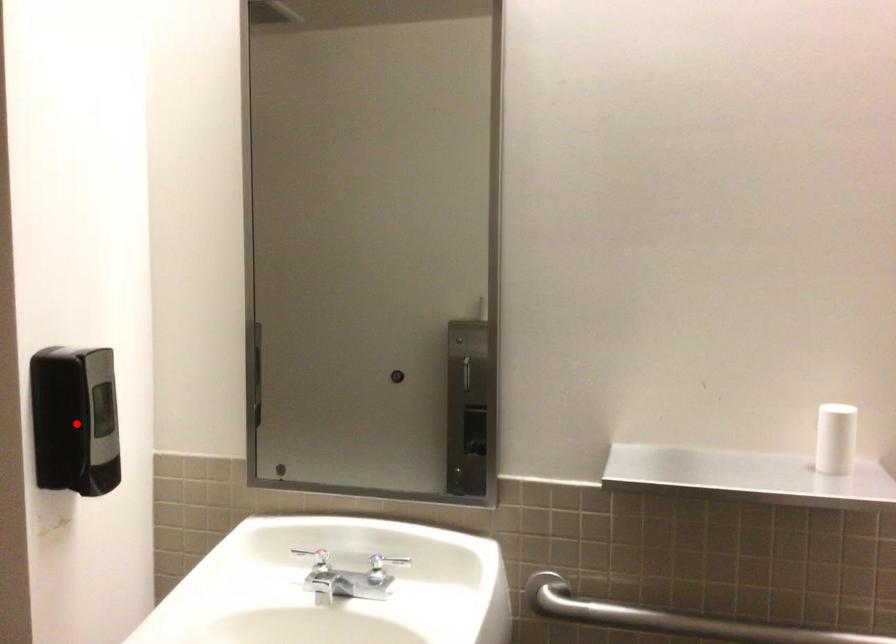
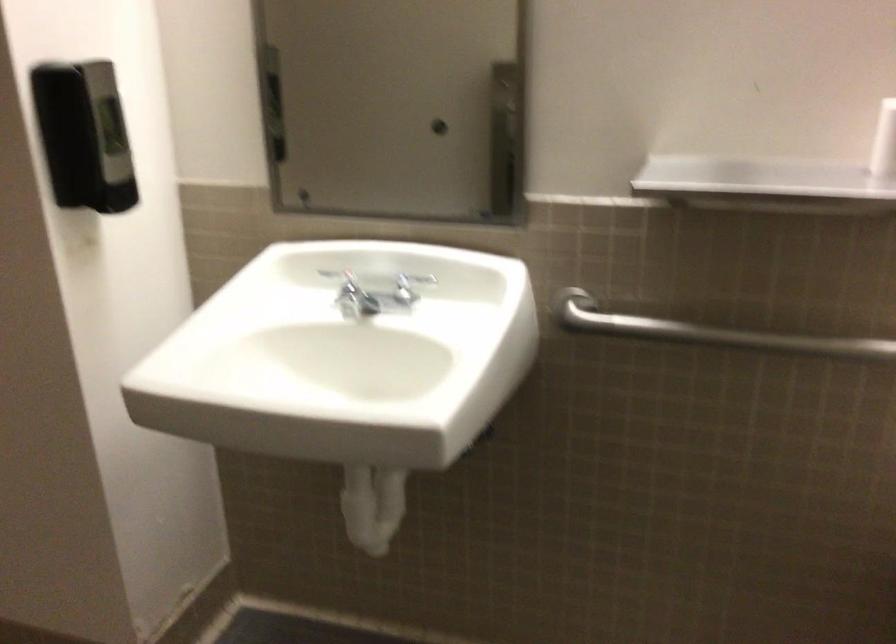
Locate, in the second image, the point that corresponds to the highlighted location in the first image.

(83, 136)